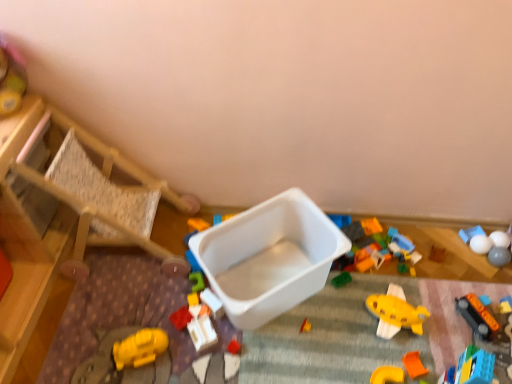
Find the location of a particular element. The width and height of the screenshot is (512, 384). spots to the right of orange plastic train at lower right, which is the 5th toy in right-to-left order is located at coordinates (499, 319).